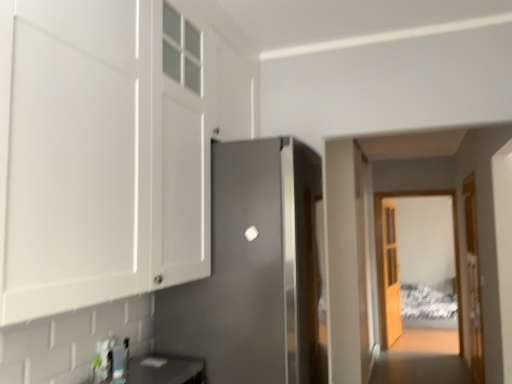
In order to face satin silver refrigerator at center, which is the 1th door from front to back, should I rotate leftwards or rightwards?

You should look left and rotate roughly 0.774 degrees.

What is the approximate height of white glossy cabinet at upper left?

1.23 meters.

This screenshot has height=384, width=512. I want to click on white glossy cabinet at upper left, so pyautogui.click(x=106, y=153).

In order to face wooden door at right, the 2th door when ordered from front to back, should I rotate leftwards or rightwards?

Rotate right and turn 26.978 degrees.

Find the location of `wooden door at right, which appears as the third door when viewed from the left`. wooden door at right, which appears as the third door when viewed from the left is located at coordinates (473, 280).

Identify the location of matte black countertop at lower left. (162, 370).

Where is `satin silver refrigerator at center, positioned as the 1th door in left-to-right order`? The height and width of the screenshot is (384, 512). satin silver refrigerator at center, positioned as the 1th door in left-to-right order is located at coordinates (x=254, y=271).

Considering the positions of points (418, 287) and (318, 379), is point (418, 287) closer to camera compared to point (318, 379)?

No, it is not.

Is patterned fabric bed at center with satin silver refrigerator at center, positioned as the 1th door in left-to-right order?

patterned fabric bed at center and satin silver refrigerator at center, positioned as the 1th door in left-to-right order, are clearly separated.

Image resolution: width=512 pixels, height=384 pixels. I want to click on bed on the right of the satin silver refrigerator at center, which is the 1th door from front to back, so click(x=426, y=303).

Can you tell me how much clear glass door at center and satin silver refrigerator at center, positioned as the 1th door in left-to-right order, differ in facing direction?

clear glass door at center and satin silver refrigerator at center, positioned as the 1th door in left-to-right order, are facing 91 degrees away from each other.

Is clear glass door at center far away from satin silver refrigerator at center, which is counted as the 3th door, starting from the right?

Yes, clear glass door at center and satin silver refrigerator at center, which is counted as the 3th door, starting from the right, are quite far apart.

Between clear glass door at center and satin silver refrigerator at center, which is the 1th door from front to back, which one has larger width?

With larger width is satin silver refrigerator at center, which is the 1th door from front to back.

From a real-world perspective, does wooden door at right, which appears as the 2th door when viewed from the back, sit lower than clear glass door at center?

Yes, from a real-world perspective, wooden door at right, which appears as the 2th door when viewed from the back, is beneath clear glass door at center.

Does wooden door at right, which is the first door in right-to-left order, come behind clear glass door at center?

No.

Is point (479, 296) in front of point (379, 228)?

That is True.

Is wooden door at right, which appears as the third door when viewed from the left, bigger or smaller than clear glass door at center?

In the image, wooden door at right, which appears as the third door when viewed from the left, appears to be smaller than clear glass door at center.

Is wooden door at right, the 2th door when ordered from front to back, inside clear glass door at center?

No, wooden door at right, the 2th door when ordered from front to back, is not surrounded by clear glass door at center.

Is clear glass door at center smaller than wooden door at right, which appears as the third door when viewed from the left?

No.

What's the angular difference between clear glass door at center and wooden door at right, which appears as the third door when viewed from the left,'s facing directions?

The facing directions of clear glass door at center and wooden door at right, which appears as the third door when viewed from the left, are 89.4 degrees apart.

Is clear glass door at center at the left side of wooden door at right, the 2th door when ordered from front to back?

No, clear glass door at center is not to the left of wooden door at right, the 2th door when ordered from front to back.

Does point (124, 378) come in front of point (68, 173)?

No.

Would you say matte black countertop at lower left is a long distance from white glossy cabinet at upper left?

No, matte black countertop at lower left is not far from white glossy cabinet at upper left.

Does matte black countertop at lower left lie in front of white glossy cabinet at upper left?

That is False.

Visually, is patterned fabric bed at center positioned to the left or to the right of wooden textured door at center, positioned as the second door in right-to-left order?

Clearly, patterned fabric bed at center is on the right of wooden textured door at center, positioned as the second door in right-to-left order, in the image.

How much distance is there between patterned fabric bed at center and wooden textured door at center, which appears as the first door when viewed from the back?

patterned fabric bed at center is 1.26 meters away from wooden textured door at center, which appears as the first door when viewed from the back.

Are patterned fabric bed at center and wooden textured door at center, which appears as the first door when viewed from the back, far apart?

Absolutely, patterned fabric bed at center is distant from wooden textured door at center, which appears as the first door when viewed from the back.

From a real-world perspective, is patterned fabric bed at center located higher than wooden textured door at center, marked as the 2th door in a left-to-right arrangement?

Incorrect, from a real-world perspective, patterned fabric bed at center is lower than wooden textured door at center, marked as the 2th door in a left-to-right arrangement.

The height and width of the screenshot is (384, 512). I want to click on glass door that is above the wooden textured door at center, which appears as the first door when viewed from the back (from the image's perspective), so click(x=384, y=260).

From a real-world perspective, which is physically above, wooden textured door at center, placed as the 3th door when sorted from front to back, or clear glass door at center?

clear glass door at center, from a real-world perspective.

Which of these two, wooden textured door at center, positioned as the second door in right-to-left order, or clear glass door at center, stands shorter?

wooden textured door at center, positioned as the second door in right-to-left order.

How many degrees apart are the facing directions of wooden textured door at center, positioned as the second door in right-to-left order, and clear glass door at center?

81.9 degrees.

The width and height of the screenshot is (512, 384). In order to click on the 3rd door counting from the left of the patterned fabric bed at center in this screenshot , I will do `click(254, 271)`.

Locate an element on the screen. door above the clear glass door at center (from a real-world perspective) is located at coordinates (254, 271).

Looking at the image, which one is located closer to satin silver refrigerator at center, the 3th door positioned from the back, wooden door at right, which appears as the third door when viewed from the left, or patterned fabric bed at center?

wooden door at right, which appears as the third door when viewed from the left, is closer to satin silver refrigerator at center, the 3th door positioned from the back.

Based on their spatial positions, is satin silver refrigerator at center, the 3th door positioned from the back, or patterned fabric bed at center closer to white glossy cabinet at upper left?

Based on the image, satin silver refrigerator at center, the 3th door positioned from the back, appears to be nearer to white glossy cabinet at upper left.

Looking at the image, which one is located further to clear glass door at center, satin silver refrigerator at center, positioned as the 1th door in left-to-right order, or patterned fabric bed at center?

satin silver refrigerator at center, positioned as the 1th door in left-to-right order, lies further to clear glass door at center than the other object.

Looking at the image, which one is located closer to wooden door at right, which appears as the third door when viewed from the left, patterned fabric bed at center or satin silver refrigerator at center, the 3th door positioned from the back?

Based on the image, satin silver refrigerator at center, the 3th door positioned from the back, appears to be nearer to wooden door at right, which appears as the third door when viewed from the left.

Looking at this image, looking at the image, which one is located closer to clear glass door at center, patterned fabric bed at center or matte black countertop at lower left?

Among the two, patterned fabric bed at center is located nearer to clear glass door at center.

Estimate the real-world distances between objects in this image. Which object is closer to wooden door at right, which is the first door in right-to-left order, matte black countertop at lower left or satin silver refrigerator at center, the 3th door positioned from the back?

satin silver refrigerator at center, the 3th door positioned from the back.

Looking at the image, which one is located further to clear glass door at center, wooden textured door at center, placed as the 3th door when sorted from front to back, or white glossy cabinet at upper left?

white glossy cabinet at upper left.

Looking at the image, which one is located closer to wooden textured door at center, marked as the 2th door in a left-to-right arrangement, patterned fabric bed at center or clear glass door at center?

The object closer to wooden textured door at center, marked as the 2th door in a left-to-right arrangement, is clear glass door at center.

At what (x,y) coordinates should I click in order to perform the action: click on glass door between satin silver refrigerator at center, which is the 1th door from front to back, and wooden textured door at center, which appears as the first door when viewed from the back, along the z-axis. Please return your answer as a coordinate pair (x, y). The height and width of the screenshot is (384, 512). Looking at the image, I should click on (384, 260).

You are a GUI agent. You are given a task and a screenshot of the screen. Output one action in this format:
    pyautogui.click(x=<x>, y=<y>)
    Task: Click on the door between satin silver refrigerator at center, which is the 1th door from front to back, and clear glass door at center in the front-back direction
    
    Given the screenshot: What is the action you would take?
    pyautogui.click(x=473, y=280)

Identify the location of door between clear glass door at center and patterned fabric bed at center along the z-axis. This screenshot has height=384, width=512. (388, 273).

Locate an element on the screen. glass door between wooden door at right, which appears as the 2th door when viewed from the back, and wooden textured door at center, marked as the 2th door in a left-to-right arrangement, from front to back is located at coordinates (384, 260).